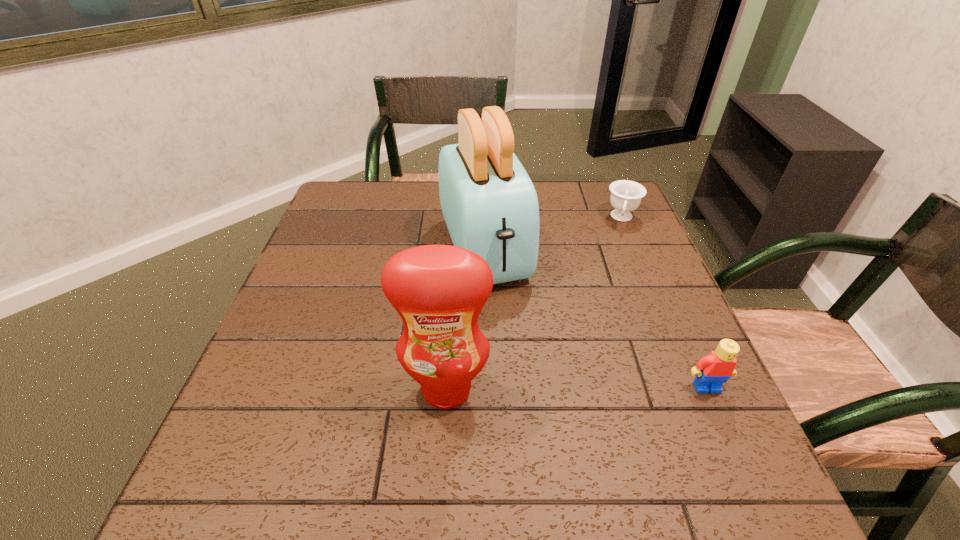
This screenshot has width=960, height=540. I want to click on condiment, so click(439, 291).

At what (x,y) coordinates should I click in order to perform the action: click on the third tallest object. Please return your answer as a coordinate pair (x, y). This screenshot has width=960, height=540. Looking at the image, I should click on (712, 371).

This screenshot has width=960, height=540. In order to click on teacup in this screenshot , I will do `click(626, 195)`.

This screenshot has height=540, width=960. Identify the location of toaster. (490, 206).

I want to click on free region located 0.330m on the side of the teacup with the handle, so click(x=609, y=312).

The width and height of the screenshot is (960, 540). I want to click on blank space located 0.170m on the side of the teacup with the handle, so click(615, 268).

The height and width of the screenshot is (540, 960). I want to click on vacant region located 0.250m on the side of the teacup with the handle, so pos(612,289).

This screenshot has width=960, height=540. What are the coordinates of `vacant space situated 0.230m on the side of the toaster with the lever` in the screenshot? It's located at (531, 374).

Identify the location of free location located on the side of the toaster with the lever. Image resolution: width=960 pixels, height=540 pixels. (549, 418).

Identify the location of vacant space situated on the side of the toaster with the lever. Image resolution: width=960 pixels, height=540 pixels. (527, 366).